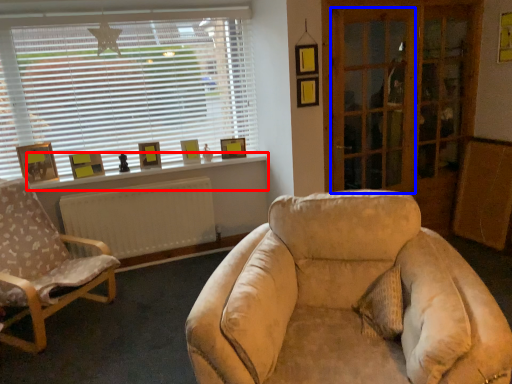
Question: Which point is closer to the camera, window sill (highlighted by a red box) or screen door (highlighted by a blue box)?

Choices:
 (A) window sill
 (B) screen door

Answer: (B)